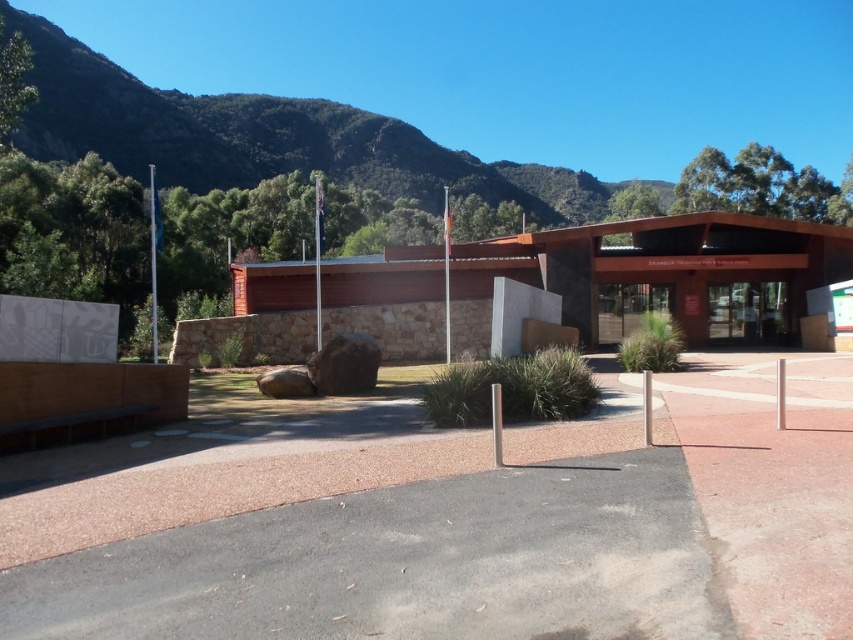
You are a landscape architect planning to place a new sculpture between the green textured rock at upper center and the transparent glass door at center. Considering their widths, which object should the sculpture be placed closer to if it needs to fit within the narrower space?

The transparent glass door at center has a narrower width than the green textured rock at upper center, so the sculpture should be placed closer to the transparent glass door at center to fit within the narrower space.

You are a visitor approaching the building and want to enter through the transparent glass doors at center. As you walk towards the entrance, will the green textured rock at upper center be on your left or right side?

The green textured rock at upper center is to the left of the transparent glass doors at center, so as you approach the doors, the rock will be on your left side.

You are standing in front of the modern building and want to walk from the paved area to the garden. You notice two points marked on the ground at coordinates point (x=329, y=152) and point (x=612, y=328). Which point is closer to you as you face the building?

Point (x=329, y=152) is closer to you because it is further to the viewer than point (x=612, y=328).